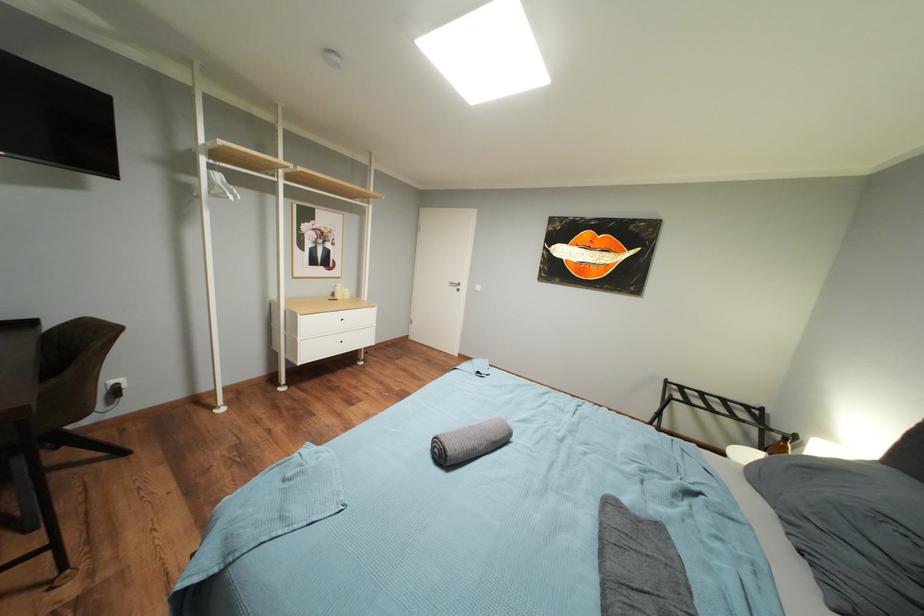
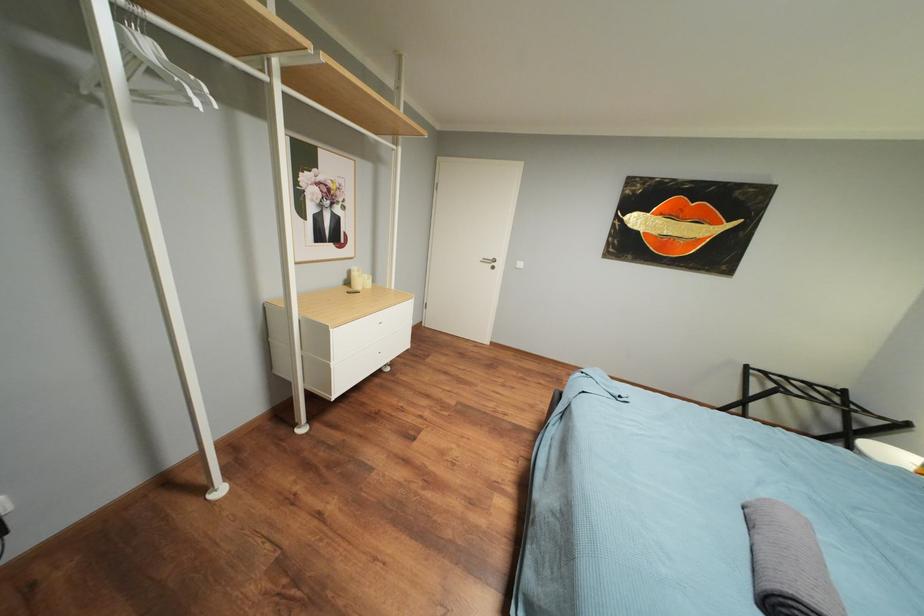
In a continuous first-person perspective shot, in which direction is the camera moving?

The cameraman moved toward left, forward.